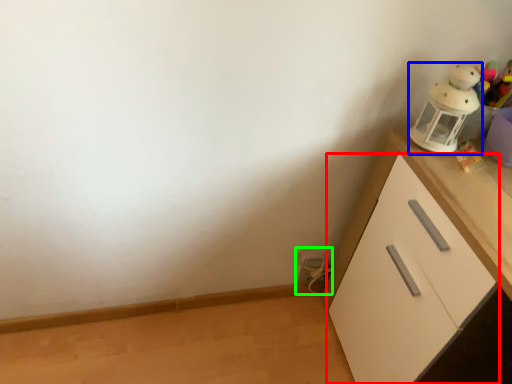
Question: Which object is the farthest from cabinetry (highlighted by a red box)? Choose among these: toy (highlighted by a blue box) or toy (highlighted by a green box).

Choices:
 (A) toy
 (B) toy

Answer: (B)